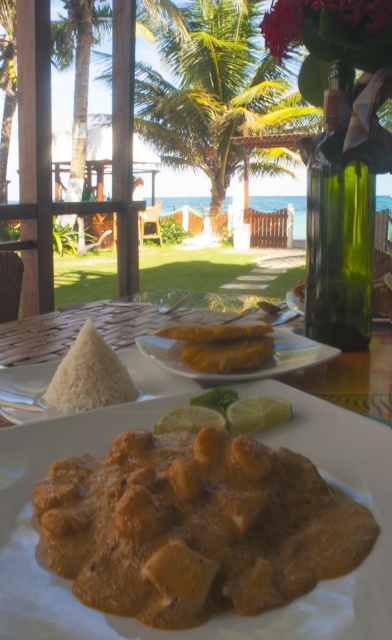
You are a food critic evaluating the presentation of dishes in this beachside dining scene. Based on the height of the smooth creamy curry at center and the white matte rice at lower left, which dish appears to be shorter?

The smooth creamy curry at center has a lesser height compared to the white matte rice at lower left, so the smooth creamy curry at center appears to be shorter.

You are a customer at this beachside restaurant and want to reach both the curry dish and the fried fish dish. The curry dish is located at point (112, 557) and the fried fish dish is at point (274, 353). Which dish should you reach for first if you want to grab the one closer to you?

The curry dish at point (112, 557) is closer to you because it is in front of the fried fish dish at point (274, 353).

You are a photographer trying to capture the perfect shot of the beachside dining scene. You notice two points in the image at coordinates point (150,515) and point (63,323). Which point should you focus on to ensure it appears larger in your photo?

Point (150,515) should be focused on because it is closer to the camera, making it appear larger in the photo than point (63,323) which is further away.